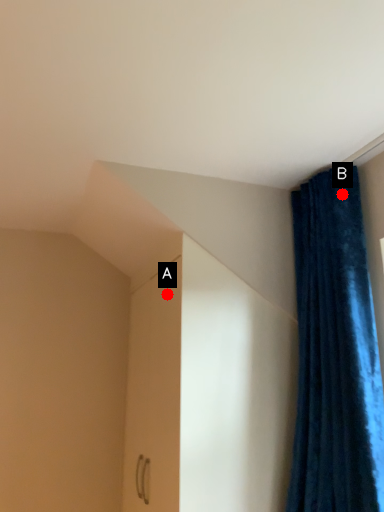
Question: Two points are circled on the image, labeled by A and B beside each circle. Which point is farther to the camera?

Choices:
 (A) A is further
 (B) B is further

Answer: (A)